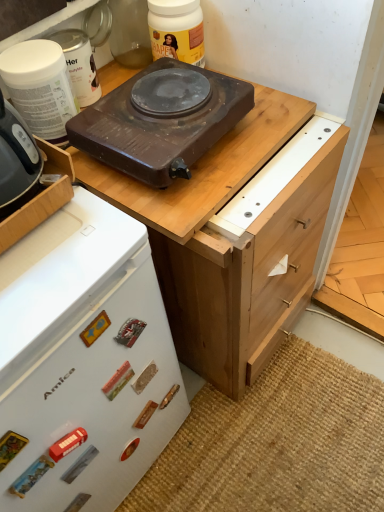
Question: Is brown wooden chest of drawers at upper center beside white plastic container at upper left, which ranks as the first kitchen appliance in left-to-right order?

Choices:
 (A) yes
 (B) no

Answer: (B)

Question: Considering the relative positions of brown wooden chest of drawers at upper center and white plastic container at upper left, the 4th kitchen appliance from the right, in the image provided, is brown wooden chest of drawers at upper center to the left of white plastic container at upper left, the 4th kitchen appliance from the right, from the viewer's perspective?

Choices:
 (A) no
 (B) yes

Answer: (A)

Question: Does brown wooden chest of drawers at upper center contain white plastic container at upper left, which ranks as the first kitchen appliance in left-to-right order?

Choices:
 (A) yes
 (B) no

Answer: (B)

Question: Is brown wooden chest of drawers at upper center at the right side of white plastic container at upper left, the 4th kitchen appliance from the right?

Choices:
 (A) yes
 (B) no

Answer: (A)

Question: From the image's perspective, does brown wooden chest of drawers at upper center appear lower than white plastic container at upper left, the 4th kitchen appliance from the right?

Choices:
 (A) yes
 (B) no

Answer: (A)

Question: Is point (177, 153) positioned closer to the camera than point (13, 100)?

Choices:
 (A) farther
 (B) closer

Answer: (B)

Question: From their relative heights in the image, would you say brown matte electric stove at upper center, positioned as the second kitchen appliance in right-to-left order, is taller or shorter than white plastic container at upper left, which ranks as the first kitchen appliance in left-to-right order?

Choices:
 (A) tall
 (B) short

Answer: (B)

Question: Would you say brown matte electric stove at upper center, the 3th kitchen appliance viewed from the left, is inside or outside white plastic container at upper left, the 4th kitchen appliance from the right?

Choices:
 (A) inside
 (B) outside

Answer: (B)

Question: From a real-world perspective, is brown matte electric stove at upper center, the 3th kitchen appliance viewed from the left, positioned above or below white plastic container at upper left, which ranks as the first kitchen appliance in left-to-right order?

Choices:
 (A) below
 (B) above

Answer: (A)

Question: From the image's perspective, is brown wooden chest of drawers at upper center above or below matte black hot plate at upper center, positioned as the fourth kitchen appliance in left-to-right order?

Choices:
 (A) below
 (B) above

Answer: (A)

Question: From a real-world perspective, is brown wooden chest of drawers at upper center physically located above or below matte black hot plate at upper center, the first kitchen appliance in the right-to-left sequence?

Choices:
 (A) below
 (B) above

Answer: (A)

Question: Is point (263, 93) closer or farther from the camera than point (173, 5)?

Choices:
 (A) closer
 (B) farther

Answer: (B)

Question: Considering the positions of brown wooden chest of drawers at upper center and matte black hot plate at upper center, the first kitchen appliance in the right-to-left sequence, in the image, is brown wooden chest of drawers at upper center wider or thinner than matte black hot plate at upper center, the first kitchen appliance in the right-to-left sequence,?

Choices:
 (A) thin
 (B) wide

Answer: (B)

Question: Is light brown wood drawer at right spatially inside white plastic container at upper left, which ranks as the 2th kitchen appliance in left-to-right order, or outside of it?

Choices:
 (A) outside
 (B) inside

Answer: (A)

Question: From a real-world perspective, is light brown wood drawer at right positioned above or below white plastic container at upper left, arranged as the third kitchen appliance when viewed from the right?

Choices:
 (A) above
 (B) below

Answer: (B)